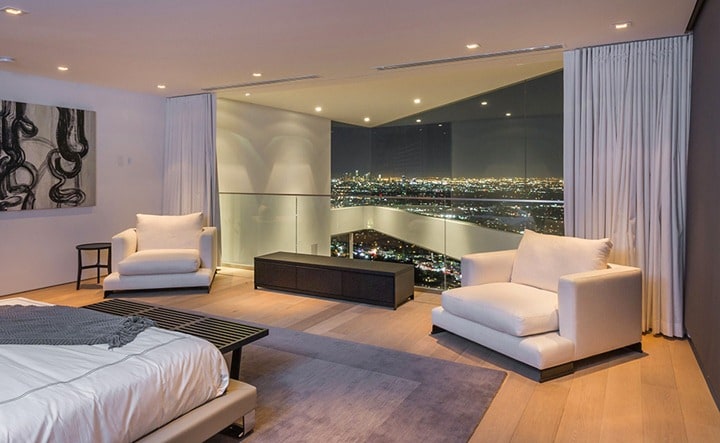
You are a GUI agent. You are given a task and a screenshot of the screen. Output one action in this format:
    pyautogui.click(x=<x>, y=<y>)
    Task: Click on the window
    This screenshot has height=443, width=720.
    Given the screenshot: What is the action you would take?
    pyautogui.click(x=386, y=219)